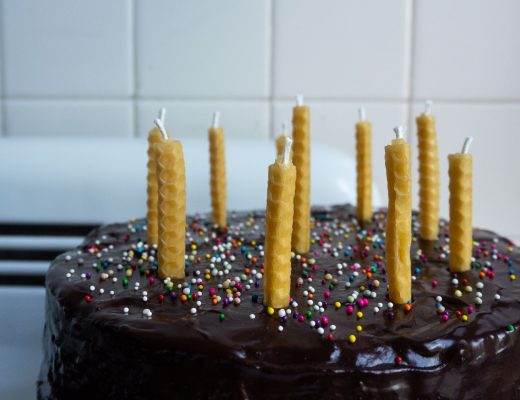
Find the location of `back tile`. back tile is located at coordinates (83, 58).